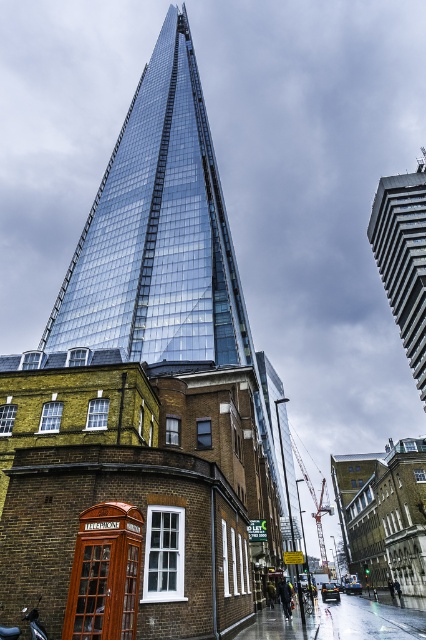
Is the position of wooden telephone box at lower left less distant than that of shiny chrome motorcycle at lower left?

Yes, wooden telephone box at lower left is closer to the viewer.

Is point (118, 586) positioned after point (45, 636)?

No, (118, 586) is closer to viewer.

This screenshot has height=640, width=426. What are the coordinates of `wooden telephone box at lower left` in the screenshot? It's located at (104, 573).

Between glassy steel tower at center and shiny chrome motorcycle at lower left, which one has more height?

glassy steel tower at center is taller.

Can you confirm if glassy steel tower at center is positioned to the left of shiny chrome motorcycle at lower left?

Yes, glassy steel tower at center is to the left of shiny chrome motorcycle at lower left.

Does point (173, 140) come in front of point (31, 609)?

No, (173, 140) is behind (31, 609).

You are a GUI agent. You are given a task and a screenshot of the screen. Output one action in this format:
    pyautogui.click(x=<x>, y=<y>)
    Task: Click on the glassy steel tower at center
    Image resolution: width=426 pixels, height=640 pixels.
    Given the screenshot: What is the action you would take?
    pyautogui.click(x=158, y=230)

Based on the photo, does glassy steel tower at center have a lesser height compared to glassy steel building at upper right?

No.

Is glassy steel tower at center to the right of glassy steel building at upper right from the viewer's perspective?

Incorrect, glassy steel tower at center is not on the right side of glassy steel building at upper right.

Between point (210, 294) and point (423, 310), which one is positioned behind?

The point (423, 310) is more distant.

At what (x,y) coordinates should I click in order to perform the action: click on glassy steel tower at center. Please return your answer as a coordinate pair (x, y). Image resolution: width=426 pixels, height=640 pixels. Looking at the image, I should click on (158, 230).